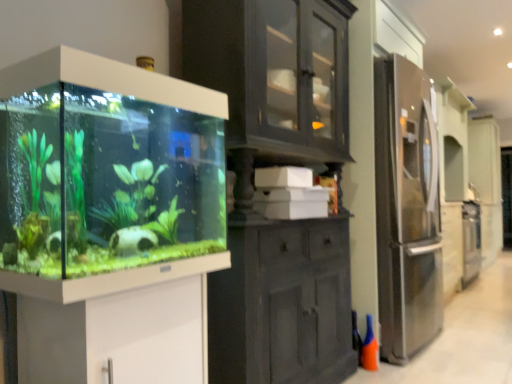
Where is `spots to the right of orange matte cone at lower right`? This screenshot has width=512, height=384. spots to the right of orange matte cone at lower right is located at coordinates (390, 359).